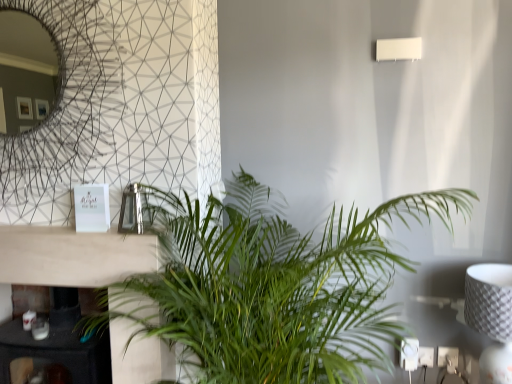
In order to click on black marble fireplace at lower left in this screenshot , I will do click(x=73, y=256).

The width and height of the screenshot is (512, 384). Describe the element at coordinates (490, 317) in the screenshot. I see `white textured lampshade at right` at that location.

The width and height of the screenshot is (512, 384). In order to click on white matte rectangular lamp at upper right in this screenshot , I will do [x=399, y=49].

You are a GUI agent. You are given a task and a screenshot of the screen. Output one action in this format:
    pyautogui.click(x=<x>, y=<y>)
    Task: Click on the black marble fireplace at lower left
    The height and width of the screenshot is (384, 512).
    Given the screenshot: What is the action you would take?
    pyautogui.click(x=73, y=256)

Is white textured lampshade at right not near green leafy plant at center?

Actually, white textured lampshade at right and green leafy plant at center are a little close together.

Measure the distance from white textured lampshade at right to green leafy plant at center.

The distance of white textured lampshade at right from green leafy plant at center is 27.98 inches.

From a real-world perspective, is white textured lampshade at right above or below green leafy plant at center?

From a real-world perspective, white textured lampshade at right is physically below green leafy plant at center.

Is white textured lampshade at right facing away from green leafy plant at center?

That's not correct — white textured lampshade at right is not looking away from green leafy plant at center.

Is green leafy plant at center completely or partially outside of black marble fireplace at lower left?

Yes, green leafy plant at center is not within black marble fireplace at lower left.

How many degrees apart are the facing directions of green leafy plant at center and black marble fireplace at lower left?

0.0422 degrees separate the facing orientations of green leafy plant at center and black marble fireplace at lower left.

Looking at this image, between green leafy plant at center and black marble fireplace at lower left, which one has less height?

black marble fireplace at lower left.

Does point (226, 329) come farther from viewer compared to point (113, 249)?

No, (226, 329) is in front of (113, 249).

Is black marble fireplace at lower left positioned beyond the bounds of green leafy plant at center?

That's correct, black marble fireplace at lower left is outside of green leafy plant at center.

Is black marble fireplace at lower left positioned with its back to green leafy plant at center?

No.

Is black marble fireplace at lower left next to green leafy plant at center and touching it?

No, black marble fireplace at lower left is not beside green leafy plant at center.

Is black marble fireplace at lower left to the left of green leafy plant at center from the viewer's perspective?

Yes.

From the image's perspective, which one is positioned higher, white textured lampshade at right or white matte rectangular lamp at upper right?

white matte rectangular lamp at upper right.

Between point (507, 295) and point (410, 38), which one is positioned in front?

Point (507, 295)

Is white textured lampshade at right positioned before white matte rectangular lamp at upper right?

Yes, white textured lampshade at right is in front of white matte rectangular lamp at upper right.

From the picture: Which is more to the left, white textured lampshade at right or white matte rectangular lamp at upper right?

From the viewer's perspective, white matte rectangular lamp at upper right appears more on the left side.

Choose the correct answer: Is green leafy plant at center inside white matte rectangular lamp at upper right or outside it?

green leafy plant at center lies outside white matte rectangular lamp at upper right.

Which object is thinner, green leafy plant at center or white matte rectangular lamp at upper right?

white matte rectangular lamp at upper right is thinner.

Between green leafy plant at center and white matte rectangular lamp at upper right, which one appears on the right side from the viewer's perspective?

white matte rectangular lamp at upper right is more to the right.

Does green leafy plant at center touch white matte rectangular lamp at upper right?

green leafy plant at center and white matte rectangular lamp at upper right are not in contact.

Which object is wider, white matte rectangular lamp at upper right or white textured lampshade at right?

white textured lampshade at right.

Is white matte rectangular lamp at upper right bigger than white textured lampshade at right?

No, white matte rectangular lamp at upper right is not bigger than white textured lampshade at right.

Who is taller, white matte rectangular lamp at upper right or white textured lampshade at right?

white textured lampshade at right is taller.

Is white textured lampshade at right at the back of white matte rectangular lamp at upper right?

No, white matte rectangular lamp at upper right is not facing the opposite direction of white textured lampshade at right.

Which is more to the left, black marble fireplace at lower left or white textured lampshade at right?

black marble fireplace at lower left.

Is point (70, 250) closer or farther from the camera than point (501, 326)?

Point (70, 250) is farther from the camera than point (501, 326).

Where is `table lamp below the green leafy plant at center (from the image's perspective)`? This screenshot has width=512, height=384. table lamp below the green leafy plant at center (from the image's perspective) is located at coordinates (490, 317).

Locate an element on the screen. The width and height of the screenshot is (512, 384). table lying behind the green leafy plant at center is located at coordinates (73, 256).

When comparing their distances from white textured lampshade at right, does white matte rectangular lamp at upper right or green leafy plant at center seem further?

Among the two, white matte rectangular lamp at upper right is located further to white textured lampshade at right.

From the picture: Based on their spatial positions, is green leafy plant at center or black marble fireplace at lower left closer to white textured lampshade at right?

green leafy plant at center is closer to white textured lampshade at right.

From the picture: Considering their positions, is white textured lampshade at right positioned closer to black marble fireplace at lower left than white matte rectangular lamp at upper right?

white textured lampshade at right is closer to black marble fireplace at lower left.

From the image, which object appears to be nearer to white textured lampshade at right, black marble fireplace at lower left or white matte rectangular lamp at upper right?

white matte rectangular lamp at upper right lies closer to white textured lampshade at right than the other object.

Considering their positions, is white textured lampshade at right positioned further to white matte rectangular lamp at upper right than black marble fireplace at lower left?

black marble fireplace at lower left is positioned further to the anchor white matte rectangular lamp at upper right.

Based on their spatial positions, is white textured lampshade at right or green leafy plant at center further from black marble fireplace at lower left?

Based on the image, white textured lampshade at right appears to be further to black marble fireplace at lower left.

When comparing their distances from white textured lampshade at right, does black marble fireplace at lower left or green leafy plant at center seem further?

Based on the image, black marble fireplace at lower left appears to be further to white textured lampshade at right.

When comparing their distances from black marble fireplace at lower left, does green leafy plant at center or white matte rectangular lamp at upper right seem closer?

A: green leafy plant at center.

The width and height of the screenshot is (512, 384). I want to click on lamp between black marble fireplace at lower left and white textured lampshade at right in the horizontal direction, so click(x=399, y=49).

At what (x,y) coordinates should I click in order to perform the action: click on houseplant between white matte rectangular lamp at upper right and white textured lampshade at right from top to bottom. Please return your answer as a coordinate pair (x, y). Image resolution: width=512 pixels, height=384 pixels. Looking at the image, I should click on (272, 286).

Where is `houseplant between black marble fireplace at lower left and white textured lampshade at right in the horizontal direction`? Image resolution: width=512 pixels, height=384 pixels. houseplant between black marble fireplace at lower left and white textured lampshade at right in the horizontal direction is located at coordinates (272, 286).

Find the location of a particular element. This screenshot has height=384, width=512. houseplant located between black marble fireplace at lower left and white matte rectangular lamp at upper right in the left-right direction is located at coordinates pyautogui.click(x=272, y=286).